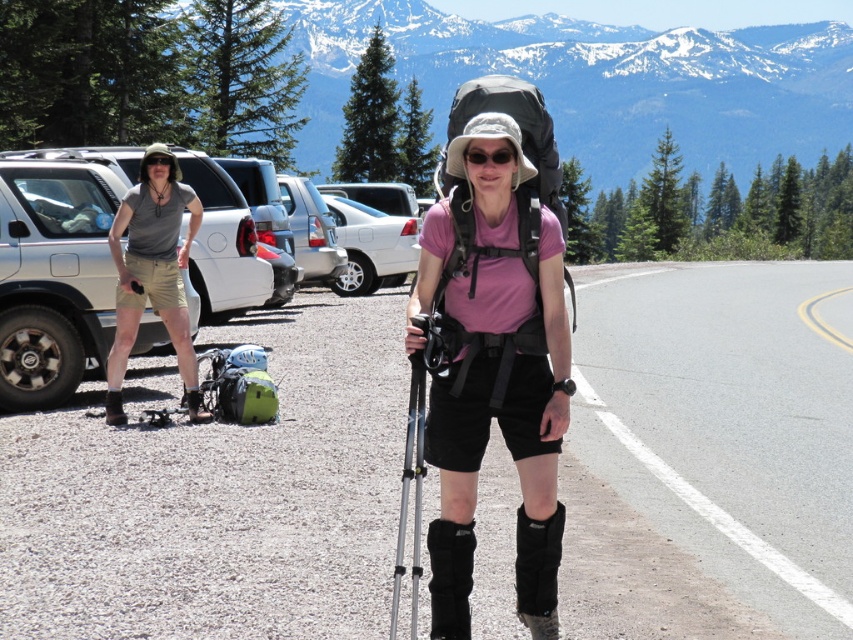
You are a hiker who just finished a long hike and wants to return to your car parked in the gray asphalt parking lot at center. You currently see the matte gray shirt at left in front of you. Which direction should you move to reach the parking lot?

The gray asphalt parking lot at center is located below the matte gray shirt at left, so you should move downward from the matte gray shirt at left to reach the parking lot.

You are a photographer trying to capture a photo of the hiker in the mountain scene. You need to ensure both the pink fabric shirt at center and the silver metallic ski pole at center are clearly visible. Based on their sizes, which object will appear larger in the photo?

The pink fabric shirt at center will appear larger in the photo because it has a greater height compared to the silver metallic ski pole at center.

You are a hiker standing at the starting point of the trail. You notice your black matte sunglasses at center are 12.34 feet away from you. If your backpack weighs 20 pounds, can you reach them without moving your backpack?

The black matte sunglasses at center are 12.34 feet away, so you can easily reach them without needing to move your 20 pound backpack since the distance is manageable.